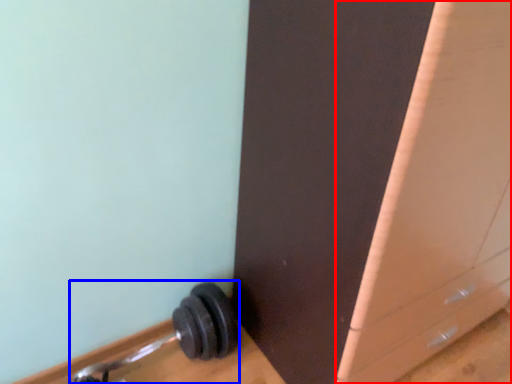
Question: Which of the following is the farthest to the observer, file cabinet (highlighted by a red box) or dumbbell (highlighted by a blue box)?

Choices:
 (A) file cabinet
 (B) dumbbell

Answer: (B)